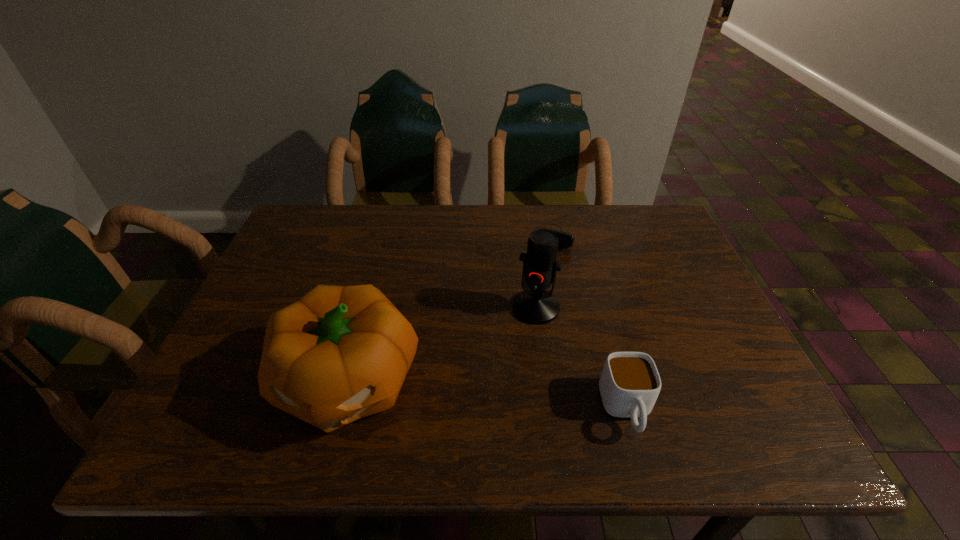
Image resolution: width=960 pixels, height=540 pixels. What are the coordinates of `vacant space on the desktop that is between the pumpkin and the cup and is positioned on the side of the microphone with the red ring` in the screenshot? It's located at (493, 397).

Where is `vacant space on the desktop that is between the leftmost object and the cup and is positioned on the front-facing side of the farthest object`? vacant space on the desktop that is between the leftmost object and the cup and is positioned on the front-facing side of the farthest object is located at coordinates (480, 396).